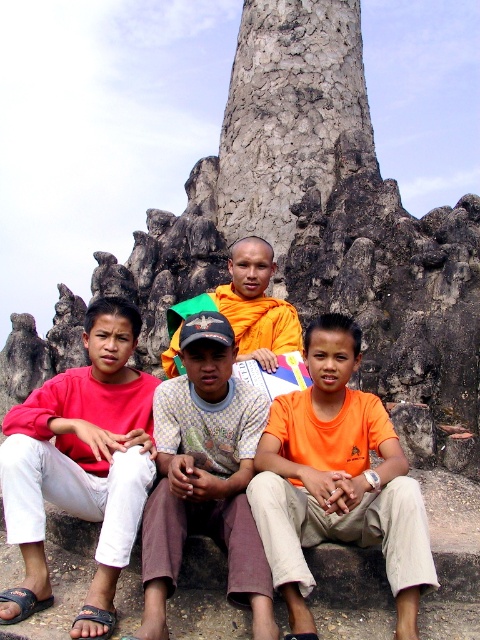
You are standing in front of the rocky area where the group is sitting. There are two points marked on the ground at coordinates point (x=355, y=349) and point (x=178, y=561). If you want to reach the point closer to you first, which coordinate should you walk towards?

You should walk towards point (x=355, y=349) because it is closer to you than point (x=178, y=561).

You are standing at the center of the image and want to hand a gift to the person wearing the matte red shirt at left. In which general direction should you move to reach them?

The matte red shirt at left is located at point (81, 465), which is to the left side of the image. You should move to the left to reach them.

You are standing at the origin point of the image coordinate system. The orange cotton shirt at center is located at point 0.753, 0.702. If you want to walk directly towards it, in which direction should you move?

The orange cotton shirt at center is located at coordinate point (x=336, y=481). Since you are at the origin, you should move diagonally towards the northeast direction to reach it.